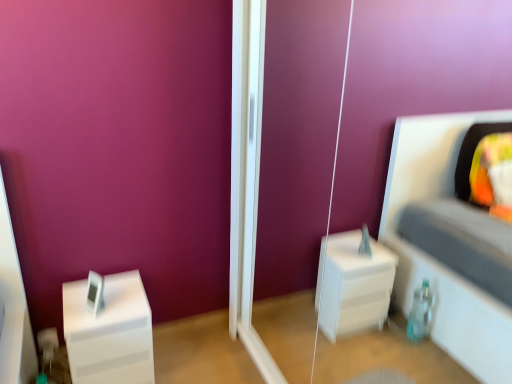
Find the location of a particular element. Image resolution: width=512 pixels, height=384 pixels. vacant point above white glossy nightstand at left (from a real-world perspective) is located at coordinates (111, 304).